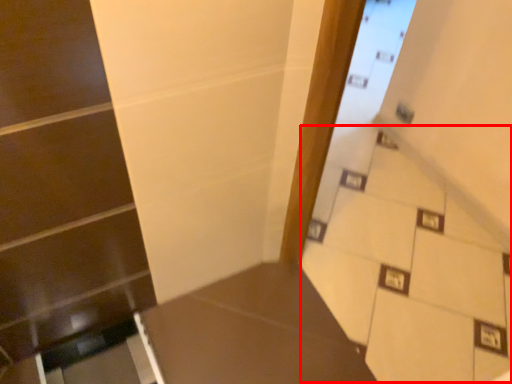
Question: From the image's perspective, where is stairwell (annotated by the red box) located in relation to table in the image?

Choices:
 (A) below
 (B) above

Answer: (B)